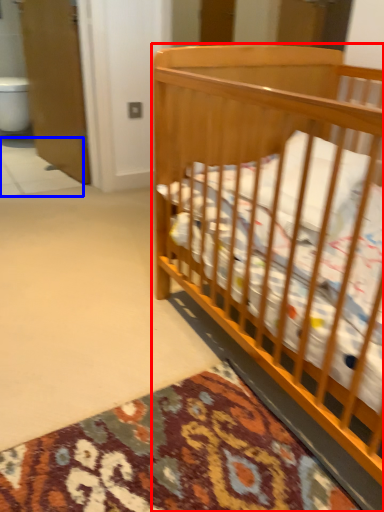
Question: Which point is closer to the camera, infant bed (highlighted by a red box) or tile (highlighted by a blue box)?

Choices:
 (A) infant bed
 (B) tile

Answer: (A)